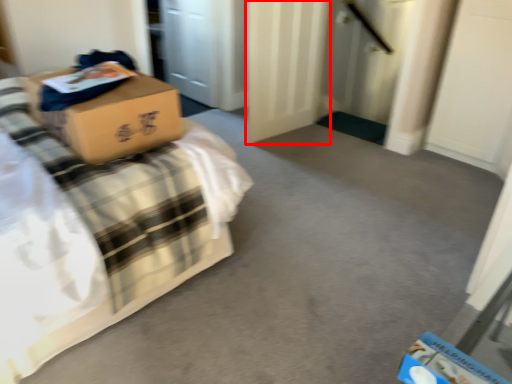
Question: From the image's perspective, what is the correct spatial relationship of door (annotated by the red box) in relation to bed?

Choices:
 (A) above
 (B) below

Answer: (A)